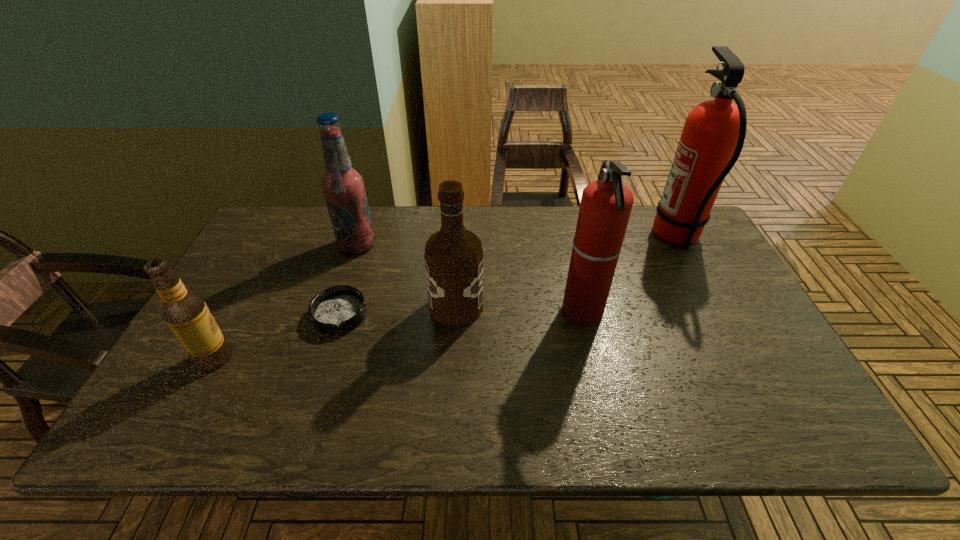
Find the location of `vacant space positioned on the handle side of the right fire extinguisher`. vacant space positioned on the handle side of the right fire extinguisher is located at coordinates (634, 237).

What are the coordinates of `vacant region located 0.400m on the handle side of the right fire extinguisher` in the screenshot? It's located at (528, 237).

Identify the location of free location located 0.360m on the handle side of the right fire extinguisher. The height and width of the screenshot is (540, 960). (540, 237).

Locate an element on the screen. The height and width of the screenshot is (540, 960). free spot located 0.140m with the nozzle and gauge on the left fire extinguisher is located at coordinates (509, 313).

Image resolution: width=960 pixels, height=540 pixels. In order to click on free spot located with the nozzle and gauge on the left fire extinguisher in this screenshot , I will do `click(509, 313)`.

Locate an element on the screen. The height and width of the screenshot is (540, 960). free spot located 0.160m with the nozzle and gauge on the left fire extinguisher is located at coordinates (502, 313).

Locate an element on the screen. vacant space located 0.380m on the right of the farthest alcohol is located at coordinates [x=497, y=245].

The width and height of the screenshot is (960, 540). What are the coordinates of `vacant area situated 0.310m on the label of the rightmost alcohol` in the screenshot? It's located at (597, 307).

This screenshot has height=540, width=960. In order to click on vacant position located on the label of the leftmost alcohol in this screenshot , I will do `click(356, 357)`.

Locate an element on the screen. The image size is (960, 540). free space located 0.060m on the left of the shortest object is located at coordinates (290, 315).